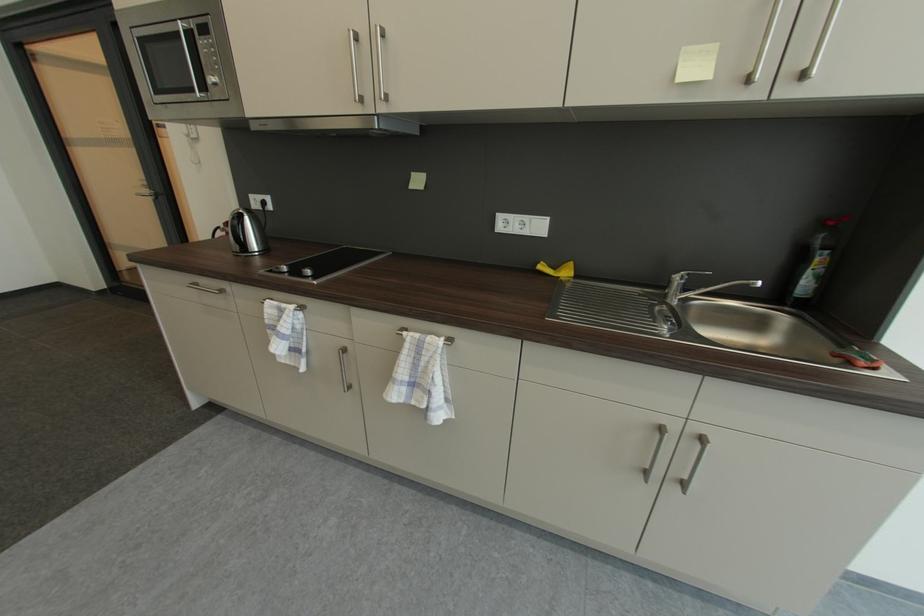
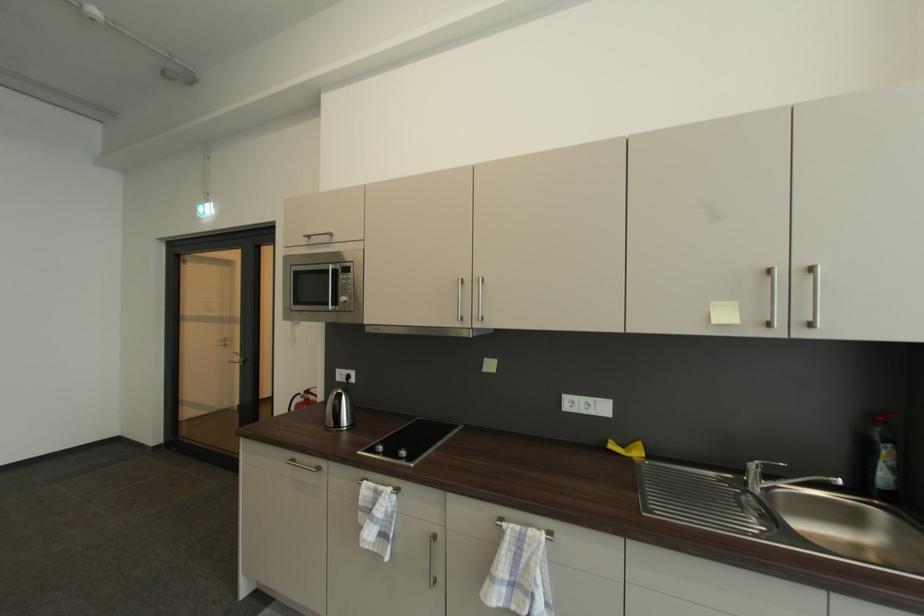
In the second image, find the point that corresponds to the point at 310,272 in the first image.

(406, 454)